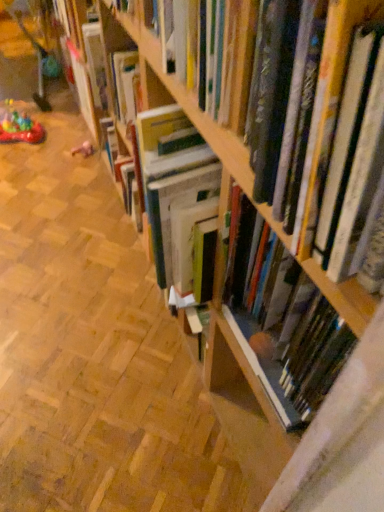
Question: Considering their positions, is wooden bookshelf at center located in front of or behind hardcover book at center, the 2th book viewed from the front?

Choices:
 (A) behind
 (B) front

Answer: (A)

Question: Considering the positions of wooden bookshelf at center and hardcover book at center, the 2th book viewed from the front, in the image, is wooden bookshelf at center wider or thinner than hardcover book at center, the 2th book viewed from the front,?

Choices:
 (A) wide
 (B) thin

Answer: (A)

Question: Which object is the farthest from the translucent plastic toy at lower left, which ranks as the first toy in left-to-right order?

Choices:
 (A) wooden bookshelf at center
 (B) pink fabric toy at lower left, acting as the 1th toy starting from the right
 (C) hardcover book at center, the 2th book viewed from the front
 (D) hardcover book at center, which appears as the second book when viewed from the back

Answer: (C)

Question: Which object is positioned farthest from the translucent plastic toy at lower left, the 2th toy when ordered from right to left?

Choices:
 (A) wooden bookshelf at center
 (B) hardcover book at center, arranged as the 1th book when viewed from the back
 (C) hardcover book at center, which appears as the second book when viewed from the back
 (D) pink fabric toy at lower left, acting as the 1th toy starting from the right

Answer: (B)